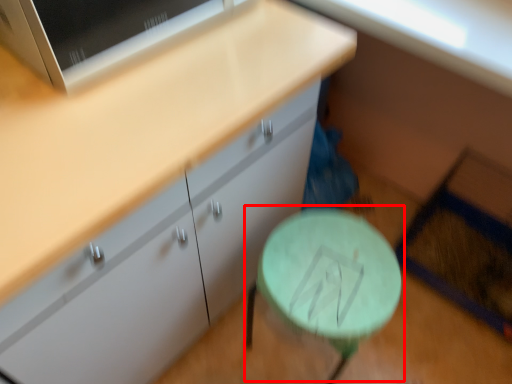
Question: From the image, what is the correct spatial relationship of round table (annotated by the red box) in relation to cabinetry?

Choices:
 (A) left
 (B) right

Answer: (B)